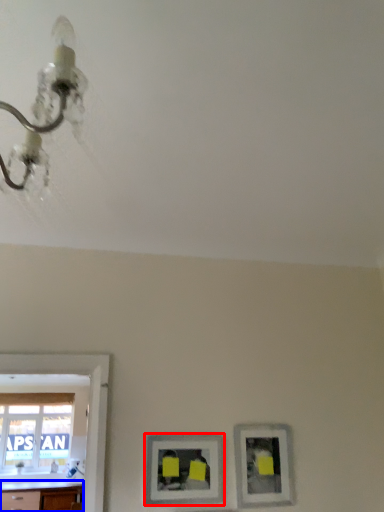
Question: Which object is further to the camera taking this photo, picture frame (highlighted by a red box) or counter top (highlighted by a blue box)?

Choices:
 (A) picture frame
 (B) counter top

Answer: (B)